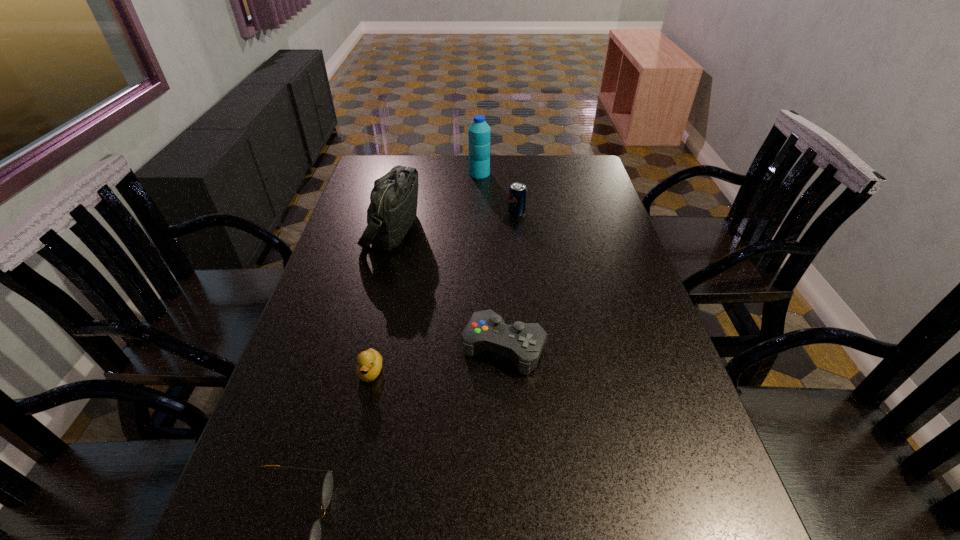
Where is `object present at the far edge`? Image resolution: width=960 pixels, height=540 pixels. object present at the far edge is located at coordinates (479, 131).

Where is `object that is at the left edge`? The image size is (960, 540). object that is at the left edge is located at coordinates (393, 200).

This screenshot has height=540, width=960. Identify the location of vacant space at the far edge of the desktop. (423, 164).

Where is `blank space at the left edge of the desktop`? This screenshot has height=540, width=960. blank space at the left edge of the desktop is located at coordinates (360, 306).

I want to click on vacant point at the right edge, so click(659, 494).

Locate an element on the screen. vacant region at the far left corner of the desktop is located at coordinates 371,181.

The height and width of the screenshot is (540, 960). What are the coordinates of `free space at the far right corner of the desktop` in the screenshot? It's located at tap(566, 157).

I want to click on blank region between the soda can and the water bottle, so click(498, 193).

The image size is (960, 540). Identify the location of vacant area between the control and the duckling. [438, 360].

This screenshot has height=540, width=960. In order to click on vacant space that's between the water bottle and the shoulder bag in this screenshot , I will do pos(436,201).